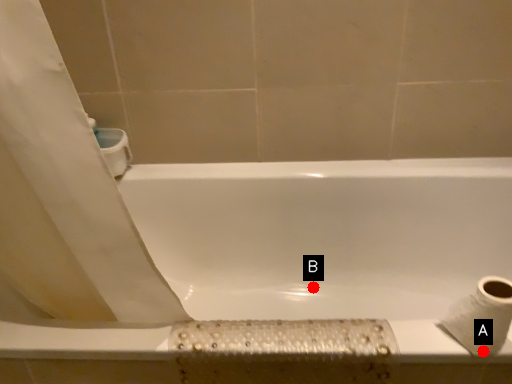
Question: Two points are circled on the image, labeled by A and B beside each circle. Which of the following is the closest to the observer?

Choices:
 (A) A is closer
 (B) B is closer

Answer: (A)